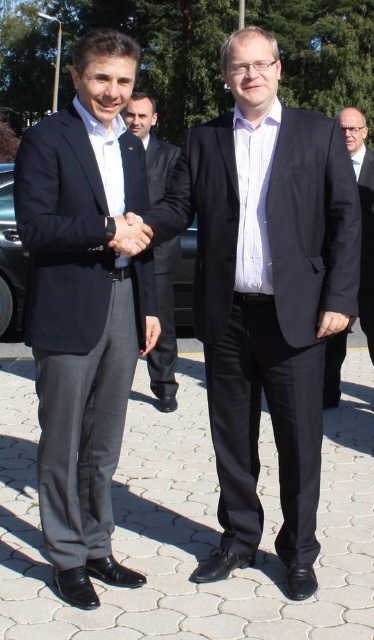
Question: Which of the following is the farthest from the observer?

Choices:
 (A) matte black suit at left
 (B) dark gray suit at right

Answer: (B)

Question: Does matte black suit at center appear under matte black hand at center?

Choices:
 (A) no
 (B) yes

Answer: (B)

Question: Is matte black suit at center to the right of matte black hand at center from the viewer's perspective?

Choices:
 (A) no
 (B) yes

Answer: (B)

Question: Which point is closer to the camera?

Choices:
 (A) (299, 120)
 (B) (148, 176)
 (C) (130, 227)
 (D) (372, 332)

Answer: (C)

Question: Which of these objects is positioned farthest from the matte black hand at center?

Choices:
 (A) dark gray suit at right
 (B) black suit at center
 (C) matte black suit at left

Answer: (A)

Question: From the image, what is the correct spatial relationship of matte black suit at left in relation to dark gray suit at right?

Choices:
 (A) below
 (B) above

Answer: (A)